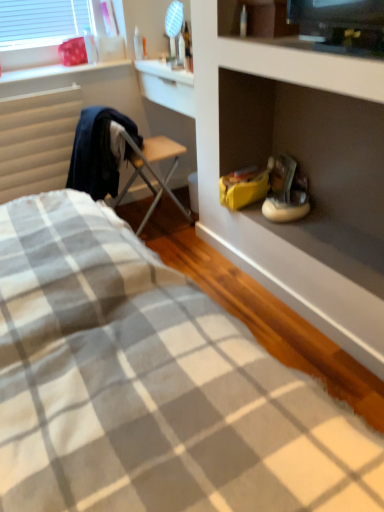
Question: From a real-world perspective, is wooden folding chair at center beneath gray checkered fabric at lower left?

Choices:
 (A) no
 (B) yes

Answer: (A)

Question: Does wooden folding chair at center appear on the right side of gray checkered fabric at lower left?

Choices:
 (A) yes
 (B) no

Answer: (B)

Question: Considering the relative positions of wooden folding chair at center and gray checkered fabric at lower left in the image provided, is wooden folding chair at center to the left of gray checkered fabric at lower left from the viewer's perspective?

Choices:
 (A) no
 (B) yes

Answer: (B)

Question: Is there a large distance between wooden folding chair at center and gray checkered fabric at lower left?

Choices:
 (A) no
 (B) yes

Answer: (B)

Question: Does wooden folding chair at center contain gray checkered fabric at lower left?

Choices:
 (A) no
 (B) yes

Answer: (A)

Question: Is wooden folding chair at center oriented away from gray checkered fabric at lower left?

Choices:
 (A) no
 (B) yes

Answer: (A)

Question: From the image's perspective, would you say matte white cabinet at upper right is shown under gray checkered fabric at lower left?

Choices:
 (A) no
 (B) yes

Answer: (A)

Question: Is matte white cabinet at upper right smaller than gray checkered fabric at lower left?

Choices:
 (A) no
 (B) yes

Answer: (B)

Question: From the image's perspective, does matte white cabinet at upper right appear higher than gray checkered fabric at lower left?

Choices:
 (A) yes
 (B) no

Answer: (A)

Question: Is matte white cabinet at upper right aimed at gray checkered fabric at lower left?

Choices:
 (A) no
 (B) yes

Answer: (A)

Question: From a real-world perspective, is matte white cabinet at upper right below gray checkered fabric at lower left?

Choices:
 (A) no
 (B) yes

Answer: (A)

Question: Does matte white cabinet at upper right appear on the left side of gray checkered fabric at lower left?

Choices:
 (A) no
 (B) yes

Answer: (A)

Question: From the image's perspective, is gray checkered fabric at lower left on white matte sneakers at center-right?

Choices:
 (A) yes
 (B) no

Answer: (B)